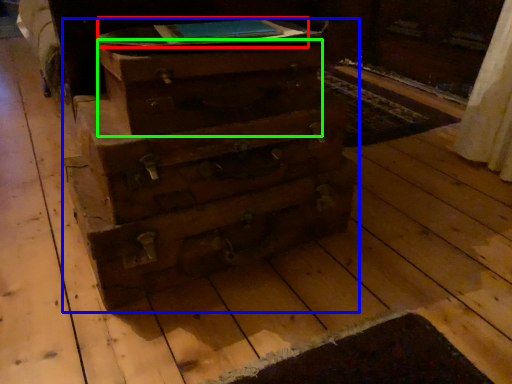
Question: Which object is the closest to the book (highlighted by a red box)? Choose among these: chest of drawers (highlighted by a blue box) or drawer (highlighted by a green box).

Choices:
 (A) chest of drawers
 (B) drawer

Answer: (B)